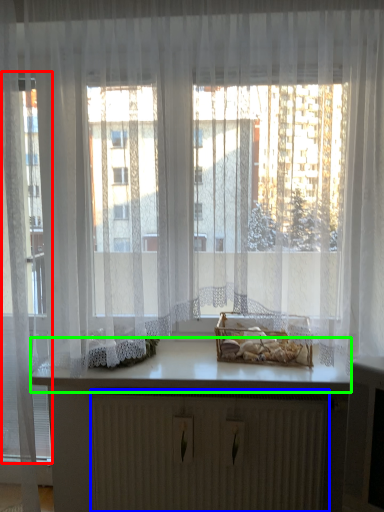
Question: Which is nearer to the glass door (highlighted by a red box)? radiator (highlighted by a blue box) or counter top (highlighted by a green box).

Choices:
 (A) radiator
 (B) counter top

Answer: (B)